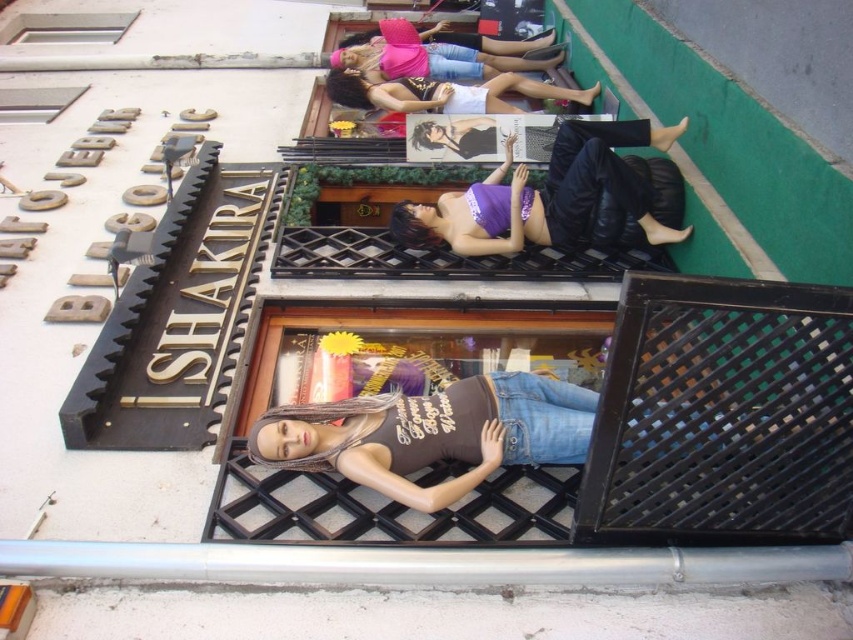
You are a window dresser trying to arrange two tank tops in the store display. You have a pink matte tank top at upper center and a matte white tank top at upper center. Which tank top has a smaller width?

The pink matte tank top at upper center has a smaller width than the matte white tank top at upper center.

You are standing in front of the iSHAKIRA store window and notice a purple satin top displayed at the center. Can you confirm if the purple satin top at center is located exactly at the coordinates point (x=547, y=195)?

Yes, the point (x=547, y=195) corresponds to the purple satin top at center.

You are a customer looking to buy a summer outfit. You see the purple satin top at center and the matte white tank top at upper center in the store window. Which top is narrower in width?

The purple satin top at center has a lesser width compared to the matte white tank top at upper center, so the purple satin top at center is narrower.